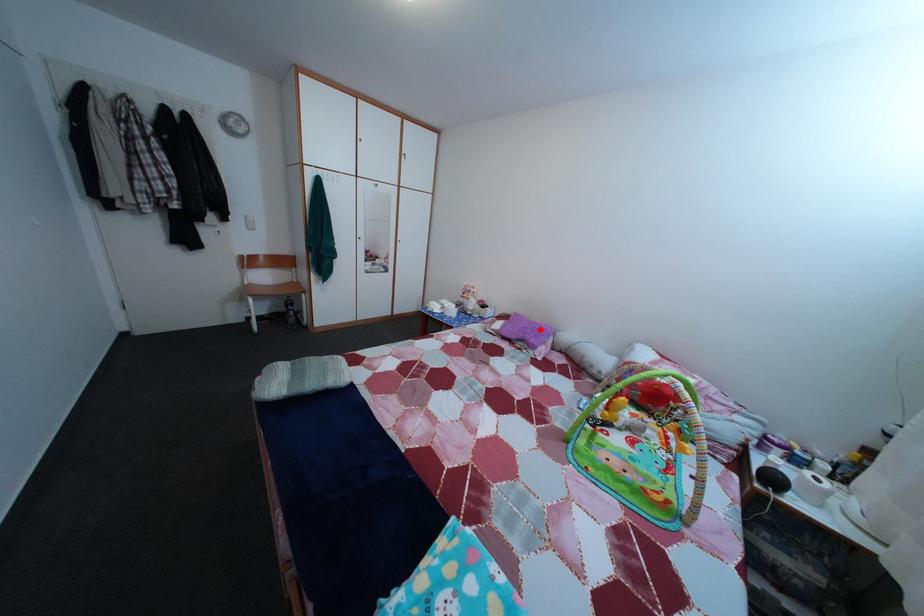
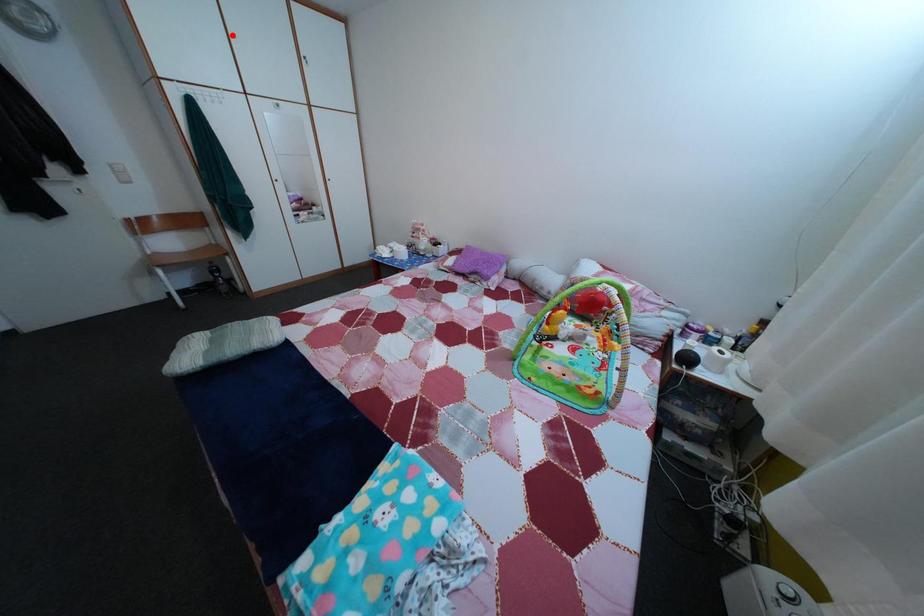
I am providing you with two images of the same scene from different viewpoints. A red point is marked on the first image and another point is marked on the second image. Are the points marked in image1 and image2 representing the same 3D position?

No